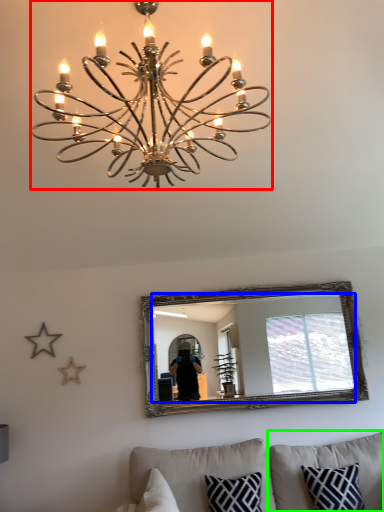
Question: Estimate the real-world distances between objects in this image. Which object is farther from lamp (highlighted by a red box), mirror (highlighted by a blue box) or pillow (highlighted by a green box)?

Choices:
 (A) mirror
 (B) pillow

Answer: (B)